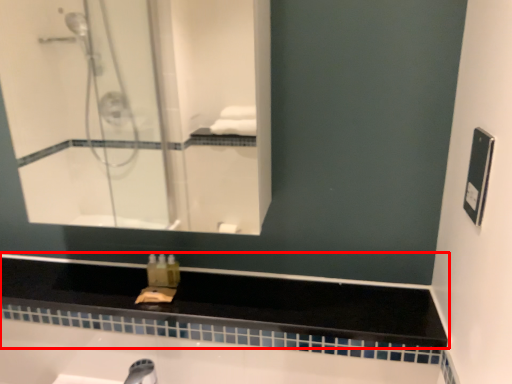
Question: Where is counter top (annotated by the red box) located in relation to mirror in the image?

Choices:
 (A) right
 (B) left

Answer: (A)